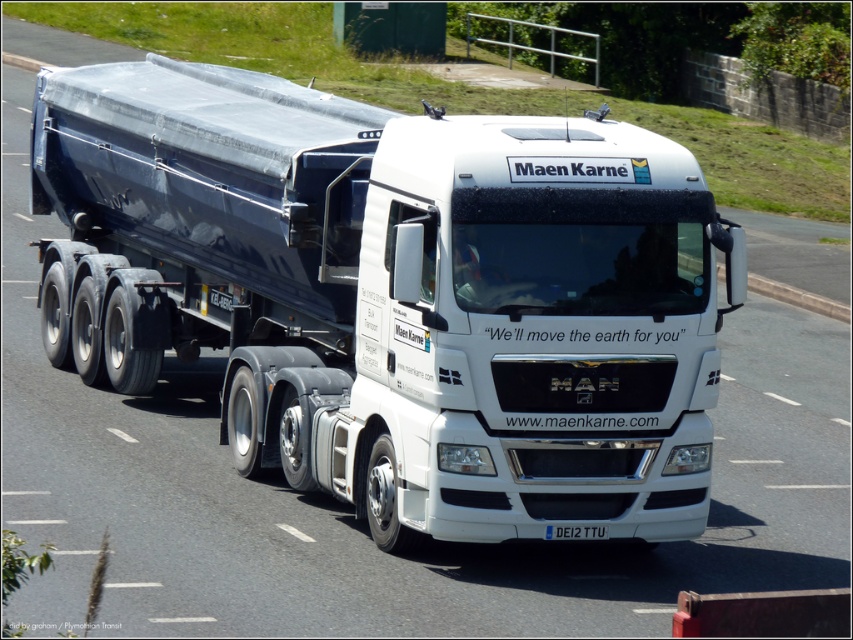
Question: Which object is farther from the camera taking this photo?

Choices:
 (A) white plastic license plate at center
 (B) white glossy truck at center

Answer: (A)

Question: Does white glossy truck at center have a larger size compared to white plastic license plate at center?

Choices:
 (A) no
 (B) yes

Answer: (B)

Question: Which point is closer to the camera?

Choices:
 (A) white plastic license plate at center
 (B) white glossy truck at center

Answer: (B)

Question: Is white glossy truck at center below white plastic license plate at center?

Choices:
 (A) no
 (B) yes

Answer: (A)

Question: Can you confirm if white glossy truck at center is bigger than white plastic license plate at center?

Choices:
 (A) yes
 (B) no

Answer: (A)